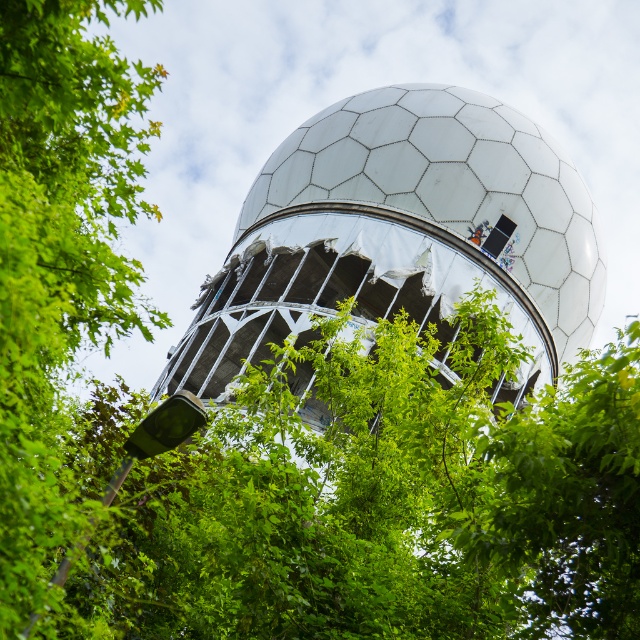
From the picture: You are standing in front of the geodesic dome and notice the green leafy tree at upper left. Based on its position, can you determine if the tree is closer to the dome or farther away from it?

The green leafy tree at upper left is located at point (60, 256), which places it closer to the dome compared to the background elements, so the tree is closer to the dome.

You are standing in a park and see the white hexagonal dome at center and the green leafy tree at center. Which object is located to the left of the other?

The white hexagonal dome at center is positioned on the left side of green leafy tree at center.